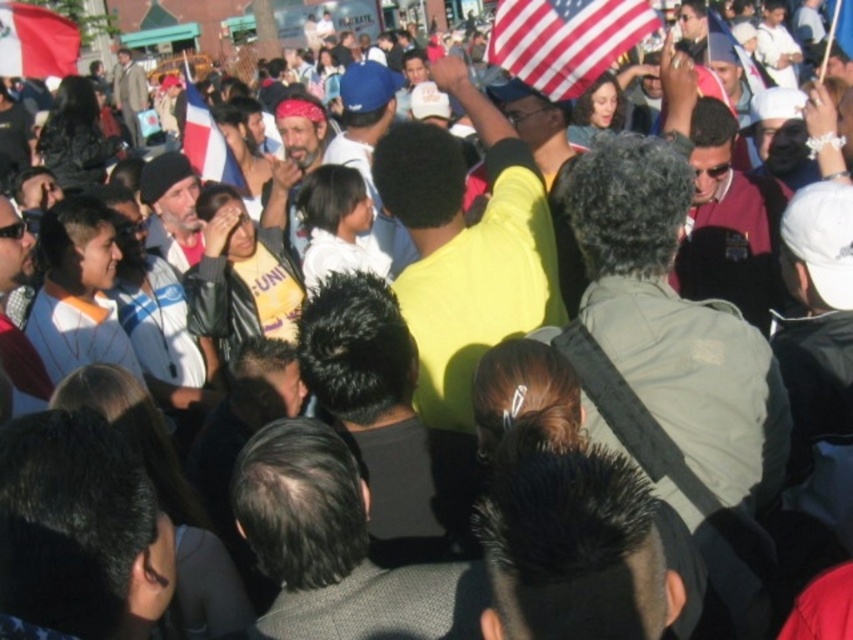
Which is more to the left, white fabric flag at center or american flag at upper right?

From the viewer's perspective, white fabric flag at center appears more on the left side.

Who is positioned more to the right, white fabric flag at center or american flag at upper right?

From the viewer's perspective, american flag at upper right appears more on the right side.

Between point (212, 140) and point (747, 60), which one is positioned in front?

Positioned in front is point (212, 140).

Where is `white fabric flag at center`? white fabric flag at center is located at coordinates (207, 141).

Does point (537, 17) come closer to viewer compared to point (720, 35)?

That is True.

Does american flag at upper center appear over american flag at upper right?

Actually, american flag at upper center is below american flag at upper right.

Between point (498, 29) and point (728, 38), which one is positioned behind?

Point (728, 38)

Where is `american flag at upper center`? The image size is (853, 640). american flag at upper center is located at coordinates (566, 38).

Who is positioned more to the left, red fabric flag at upper left or white fabric flag at center?

Positioned to the left is red fabric flag at upper left.

This screenshot has width=853, height=640. Identify the location of red fabric flag at upper left. (35, 42).

Does point (9, 26) come farther from viewer compared to point (215, 157)?

That is True.

At what (x,y) coordinates should I click in order to perform the action: click on red fabric flag at upper left. Please return your answer as a coordinate pair (x, y). Looking at the image, I should click on (35, 42).